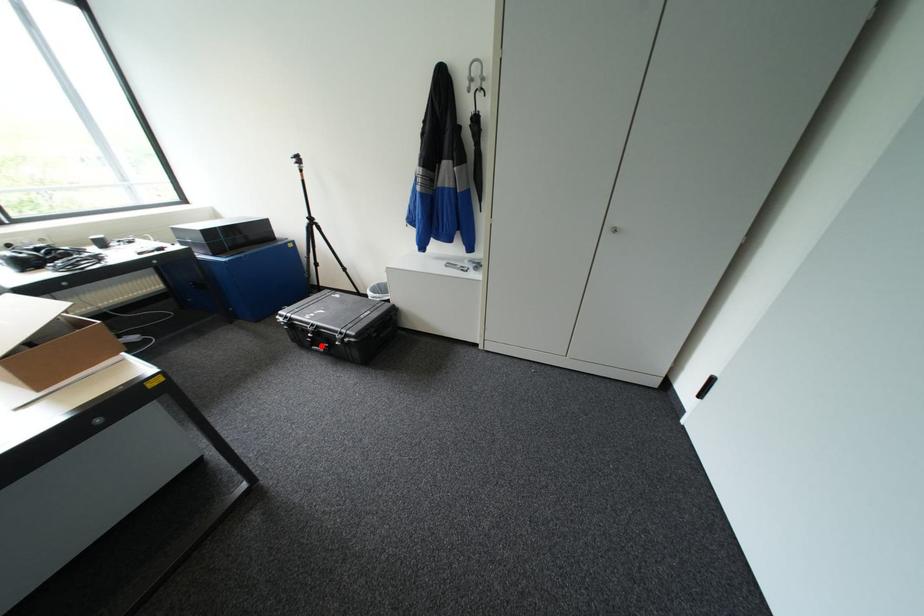
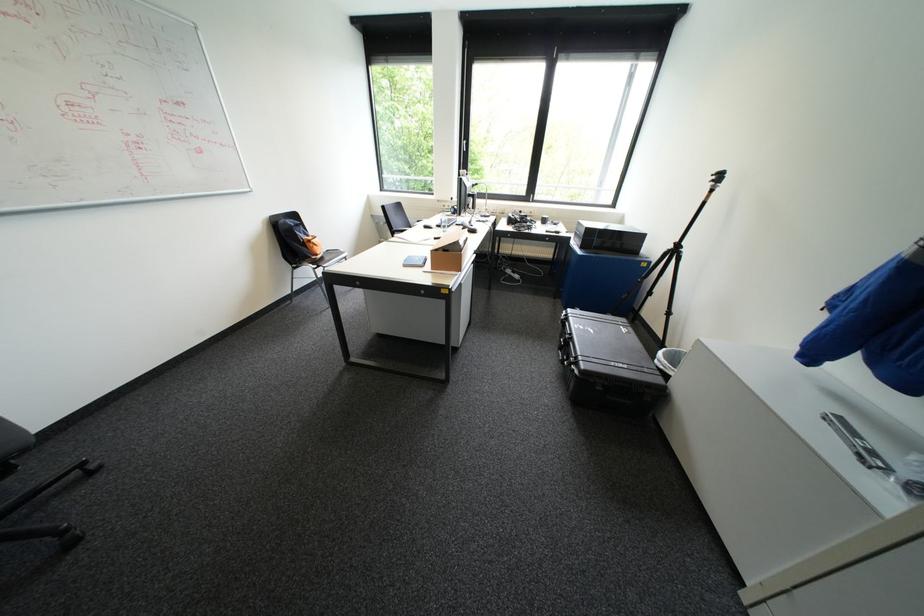
Question: I am providing you with two images of the same scene from different viewpoints. In image1, a red point is highlighted. Considering the same 3D point in image2, which of the following is correct?

Choices:
 (A) It is closer
 (B) It is farther

Answer: (A)